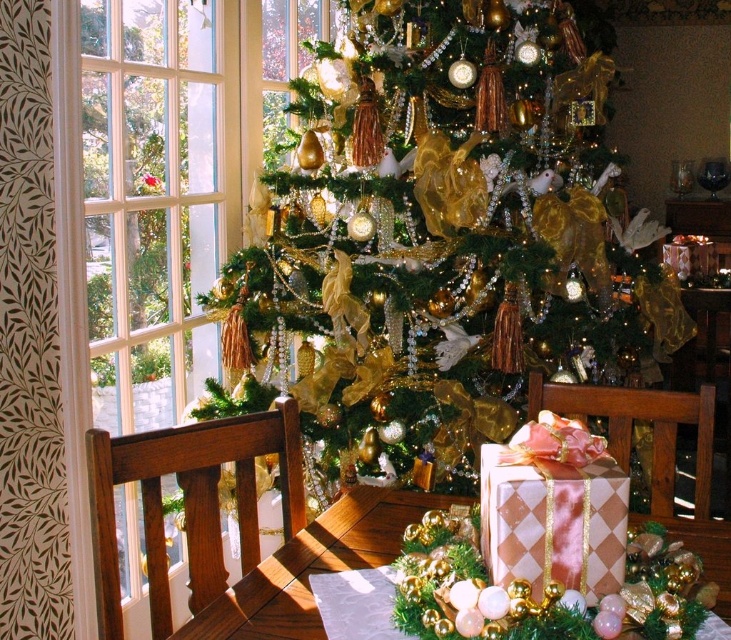
Can you confirm if gold shiny ornaments at center is positioned above clear glass window at left?

No.

Between gold shiny ornaments at center and clear glass window at left, which one has less height?

gold shiny ornaments at center is shorter.

Who is more forward, (x=560, y=326) or (x=121, y=564)?

Point (x=121, y=564) is more forward.

Identify the location of gold shiny ornaments at center. (444, 230).

What do you see at coordinates (444, 230) in the screenshot? Image resolution: width=731 pixels, height=640 pixels. I see `gold shiny ornaments at center` at bounding box center [444, 230].

Does gold shiny ornaments at center appear on the right side of pink paper gift at center?

Correct, you'll find gold shiny ornaments at center to the right of pink paper gift at center.

Who is more forward, (366, 67) or (363, 513)?

Point (363, 513)

Identify the location of gold shiny ornaments at center. The image size is (731, 640). (444, 230).

Does clear glass window at left have a lesser height compared to pink satin gift at center?

In fact, clear glass window at left may be taller than pink satin gift at center.

Does clear glass window at left have a greater width compared to pink satin gift at center?

Correct, the width of clear glass window at left exceeds that of pink satin gift at center.

What are the coordinates of `clear glass window at left` in the screenshot? It's located at (173, 180).